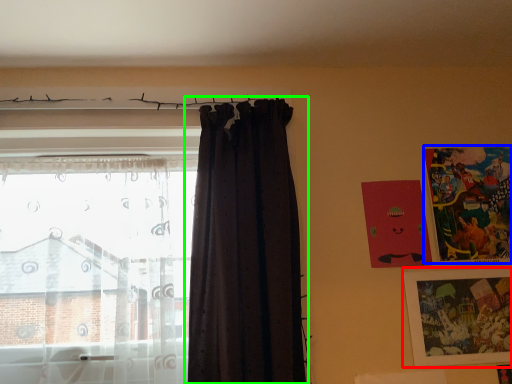
Question: Which is farther away from picture frame (highlighted by a red box)? picture frame (highlighted by a blue box) or curtain (highlighted by a green box)?

Choices:
 (A) picture frame
 (B) curtain

Answer: (B)